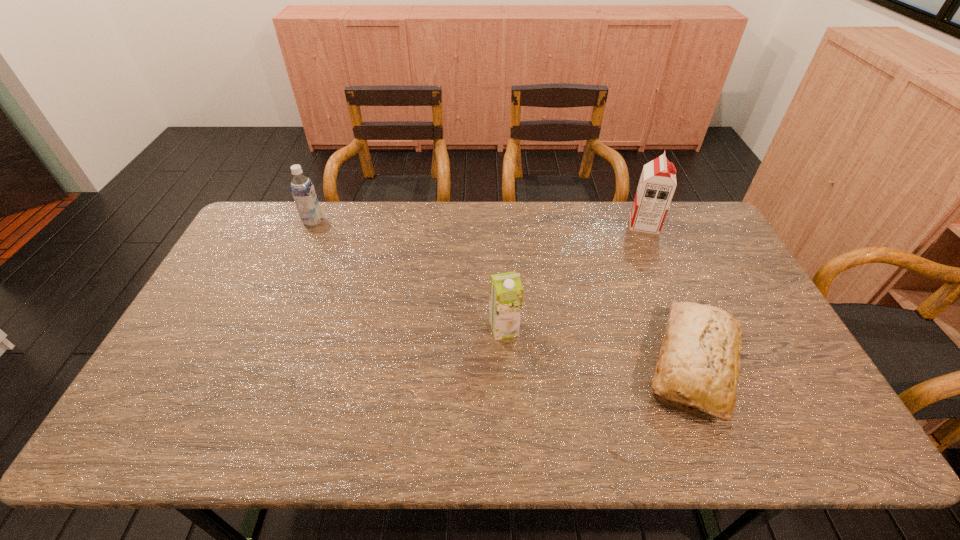
Where is `vacant region that satisfies the following two spatial constraints: 1. on the back side of the bread; 2. on the label of the leftmost soya milk`? Image resolution: width=960 pixels, height=540 pixels. vacant region that satisfies the following two spatial constraints: 1. on the back side of the bread; 2. on the label of the leftmost soya milk is located at coordinates (635, 221).

Image resolution: width=960 pixels, height=540 pixels. Find the location of `vacant area in the image that satisfies the following two spatial constraints: 1. on the label of the shortest object; 2. on the right side of the leftmost soya milk`. vacant area in the image that satisfies the following two spatial constraints: 1. on the label of the shortest object; 2. on the right side of the leftmost soya milk is located at coordinates (251, 366).

Locate an element on the screen. vacant position in the image that satisfies the following two spatial constraints: 1. on the back side of the tallest object; 2. on the right side of the bread is located at coordinates (636, 224).